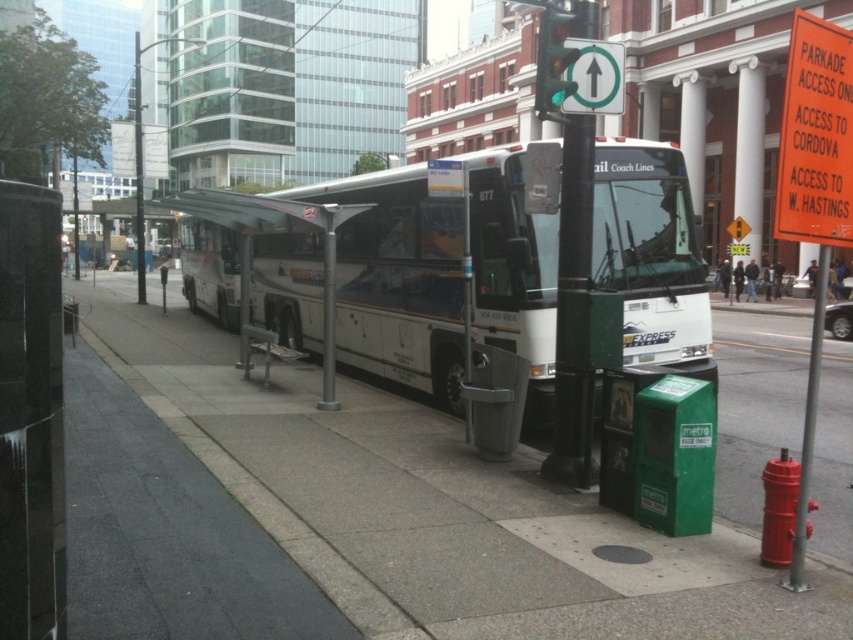
Who is positioned more to the right, gray concrete pavement at center or white glossy bus at center?

Positioned to the right is gray concrete pavement at center.

Does gray concrete pavement at center have a lesser width compared to white glossy bus at center?

Incorrect, gray concrete pavement at center's width is not less than white glossy bus at center's.

Is point (328, 452) closer to camera compared to point (369, 296)?

That is True.

At what (x,y) coordinates should I click in order to perform the action: click on gray concrete pavement at center. Please return your answer as a coordinate pair (x, y). This screenshot has height=640, width=853. Looking at the image, I should click on (450, 508).

Based on the photo, which of these two, gray concrete pavement at center or metallic pole at lower right, stands taller?

metallic pole at lower right

The image size is (853, 640). What do you see at coordinates (450, 508) in the screenshot?
I see `gray concrete pavement at center` at bounding box center [450, 508].

You are a GUI agent. You are given a task and a screenshot of the screen. Output one action in this format:
    pyautogui.click(x=<x>, y=<y>)
    Task: Click on the gray concrete pavement at center
    The width and height of the screenshot is (853, 640).
    Given the screenshot: What is the action you would take?
    pyautogui.click(x=450, y=508)

Where is `gray concrete pavement at center`? gray concrete pavement at center is located at coordinates (450, 508).

Does point (456, 237) come closer to viewer compared to point (554, 92)?

No, it is not.

Which is more to the right, white glossy bus at center or metallic green traffic light at upper center?

metallic green traffic light at upper center

Locate an element on the screen. The width and height of the screenshot is (853, 640). white glossy bus at center is located at coordinates (397, 280).

Where is `white glossy bus at center`? white glossy bus at center is located at coordinates (397, 280).